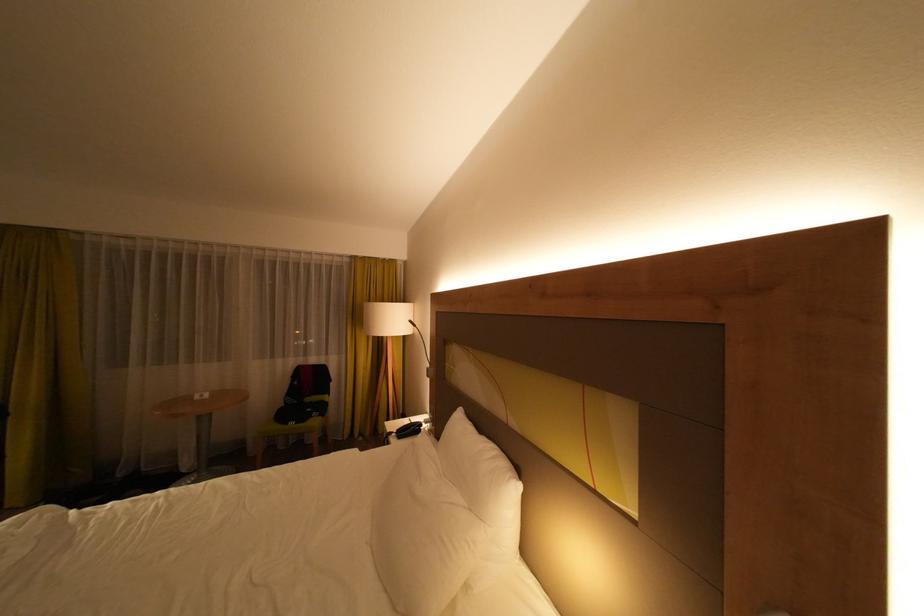
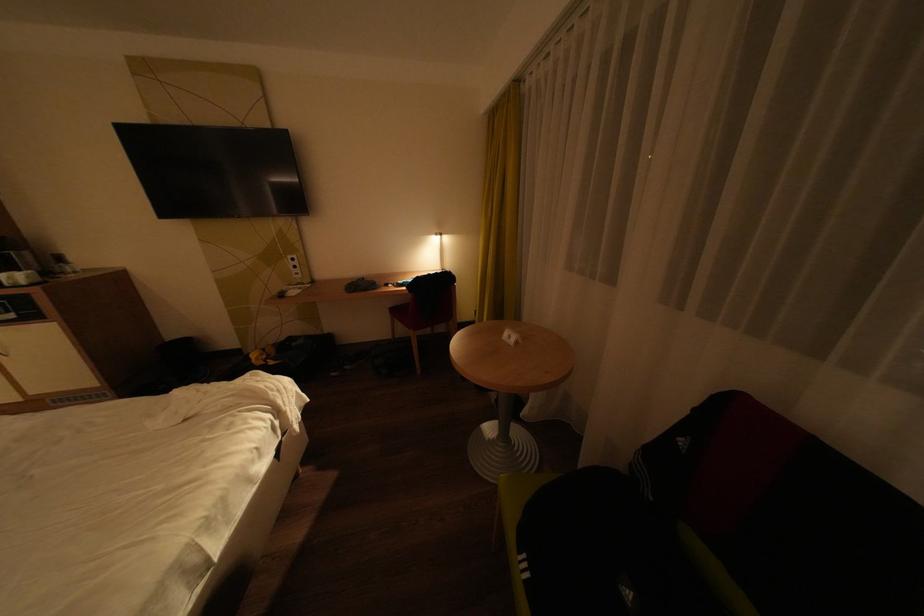
Where in the second image is the point corresponding to the point at 212,397 from the first image?

(519, 338)